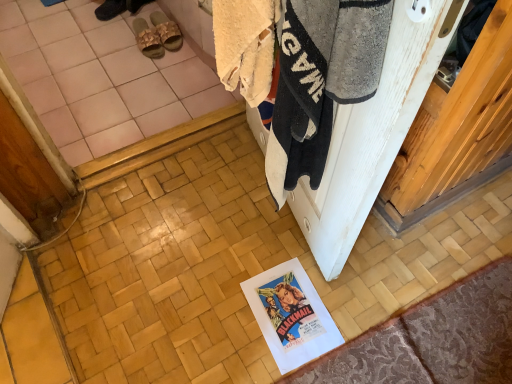
The image size is (512, 384). I want to click on free space above white paper at lower center (from a real-world perspective), so click(290, 312).